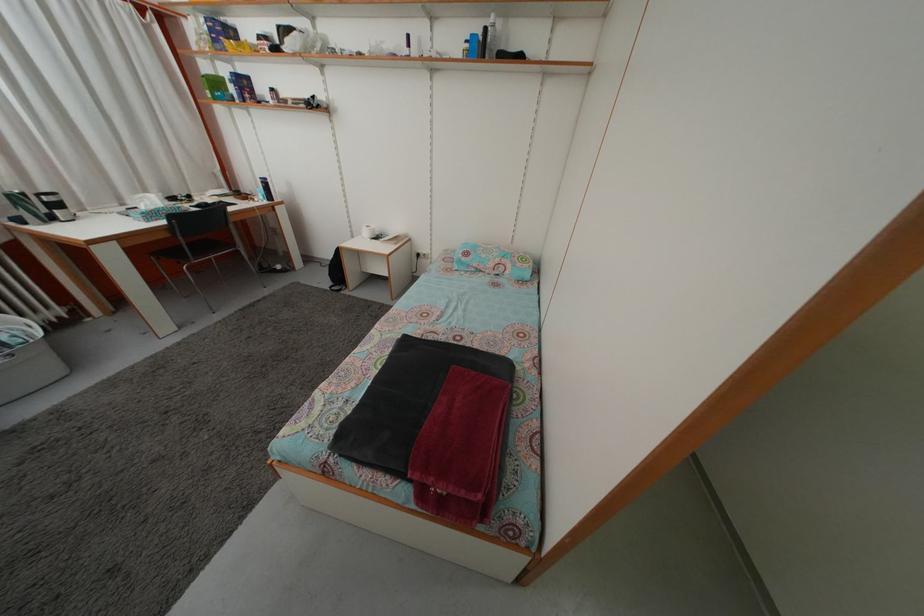
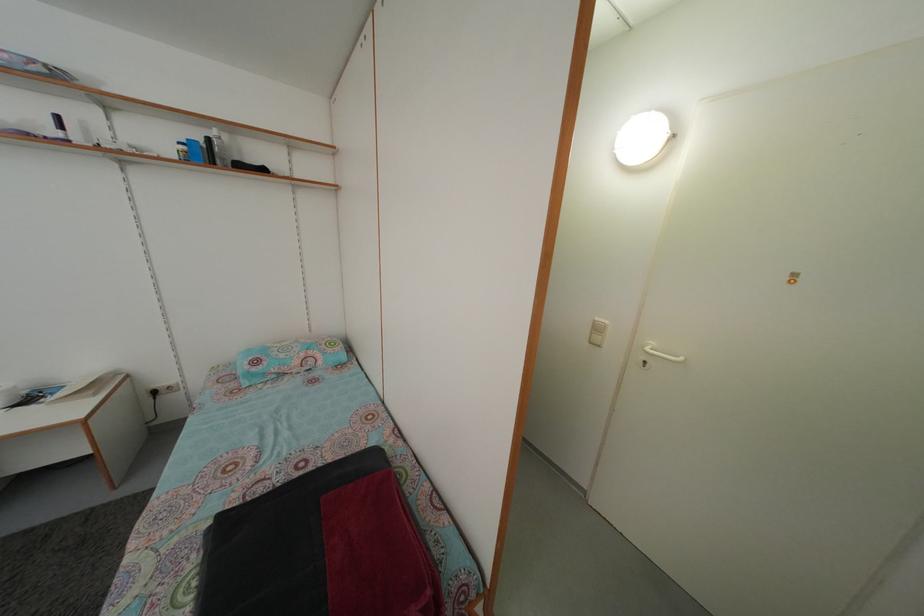
Question: The camera is either moving clockwise (left) or counter-clockwise (right) around the object. The first image is from the beginning of the video and the second image is from the end. Is the camera moving left or right when shooting the video?

Choices:
 (A) Left
 (B) Right

Answer: (A)